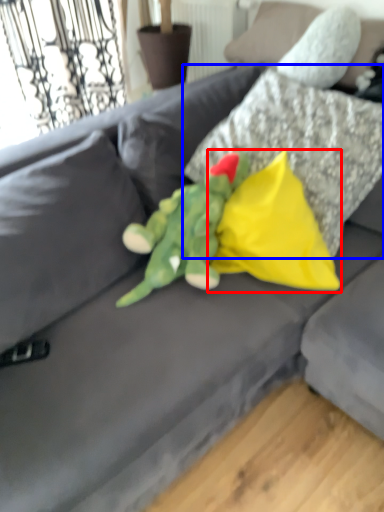
Question: Which of the following is the farthest to the observer, pillow (highlighted by a red box) or pillow (highlighted by a blue box)?

Choices:
 (A) pillow
 (B) pillow

Answer: (A)